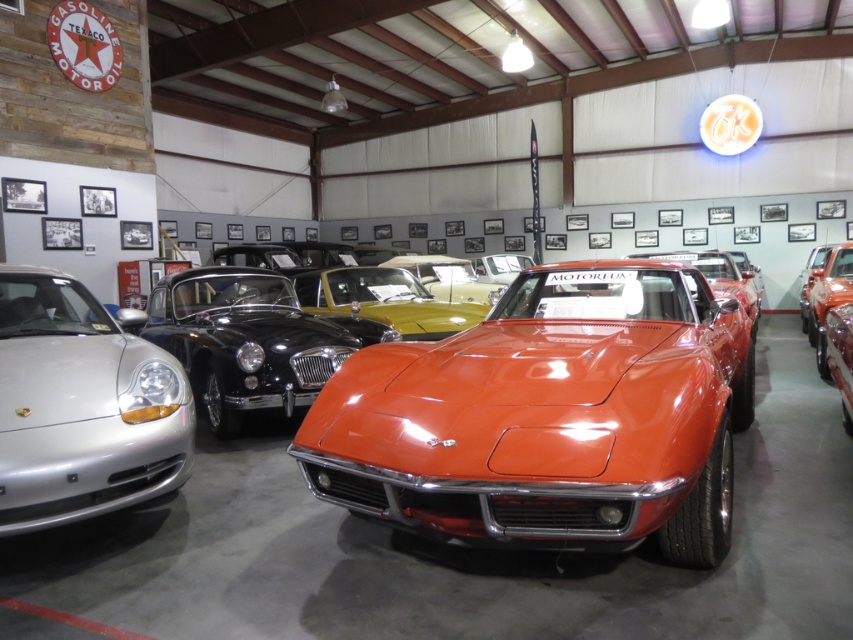
You are a photographer standing in the showroom and want to take a picture of both the glossy orange car at center and the glossy orange sports car at center. Which car should you focus on first to ensure it appears sharp in the photo?

You should focus on the glossy orange car at center first because it is closer to the viewer than the glossy orange sports car at center, so it requires proper focus to appear sharp in the photo.

You are a photographer planning to take a photo of the glossy orange car at center and the satin silver porsche at left. Which car should you focus on first if you want to capture both in a single shot without moving the camera?

The glossy orange car at center is located above the satin silver porsche at left, so you should focus on the satin silver porsche at left first to ensure both are in the frame.

You are a car enthusiast visiting the showroom and want to park your compact car between the glossy orange car at center and the satin silver porsche at left. Given that your car is 1.8 meters wide, can you fit it between them?

The glossy orange car at center is wider than the satin silver porsche at left. Therefore, the space between them may be sufficient, but since the exact distance isn not provided, it is uncertain. However, since the orange car is wider, the gap might accommodate your 1.8 meter car. Consult staff for precise measurements.